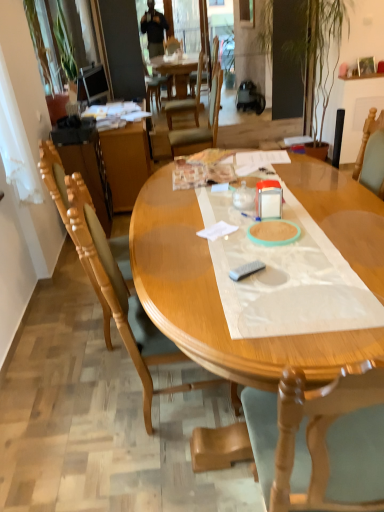
This screenshot has height=512, width=384. Describe the element at coordinates (92, 85) in the screenshot. I see `matte black television at upper left` at that location.

This screenshot has width=384, height=512. What do you see at coordinates (113, 167) in the screenshot?
I see `wooden desk at center` at bounding box center [113, 167].

In order to click on transparent plastic bottle at center in this screenshot , I will do `click(244, 197)`.

Which point is more forward, (299,271) or (355,335)?

Point (355,335)

Can you confirm if transparent plastic sheet at center is smaller than wooden table at center?

Indeed, transparent plastic sheet at center has a smaller size compared to wooden table at center.

From a real-world perspective, which is physically below, transparent plastic sheet at center or wooden table at center?

wooden table at center is physically lower.

Is transparent plastic sheet at center far from wooden table at center?

No, there isn't a large distance between transparent plastic sheet at center and wooden table at center.

The width and height of the screenshot is (384, 512). There is a wooden desk at center. In order to click on the 2nd chair above it (from a real-world perspective) in this screenshot , I will do `click(110, 279)`.

Is wooden chair at left, the first chair viewed from the front, beside wooden desk at center?

No, wooden chair at left, the first chair viewed from the front, is not in contact with wooden desk at center.

Considering the relative positions of wooden chair at left, which is counted as the third chair, starting from the back, and wooden desk at center in the image provided, is wooden chair at left, which is counted as the third chair, starting from the back, behind wooden desk at center?

No, wooden chair at left, which is counted as the third chair, starting from the back, is closer to the viewer.

Does wooden chair at left, which is counted as the third chair, starting from the back, turn towards wooden desk at center?

No.

Is light brown wood chair at left, the 2th chair in the front-to-back sequence, next to green leafy plant at upper left and touching it?

No, light brown wood chair at left, the 2th chair in the front-to-back sequence, is not next to green leafy plant at upper left.

Which point is more distant from viewer, (x=107, y=333) or (x=57, y=96)?

Positioned behind is point (x=57, y=96).

Which object is further away from the camera taking this photo, light brown wood chair at left, marked as the 2th chair in a back-to-front arrangement, or green leafy plant at upper left?

green leafy plant at upper left.

Measure the distance between light brown wood chair at left, marked as the 2th chair in a back-to-front arrangement, and green leafy plant at upper left.

9.46 feet.

Can transparent plastic sheet at center be found inside metallic silver container at center?

Actually, transparent plastic sheet at center is outside metallic silver container at center.

Which is more to the right, metallic silver container at center or transparent plastic sheet at center?

metallic silver container at center.

From the image's perspective, which is below, metallic silver container at center or transparent plastic sheet at center?

transparent plastic sheet at center.

In the scene shown: Which of these two, metallic silver container at center or transparent plastic sheet at center, is bigger?

With larger size is transparent plastic sheet at center.

Where is `chair that is the 1st one below the matte black television at upper left (from a real-world perspective)`? The image size is (384, 512). chair that is the 1st one below the matte black television at upper left (from a real-world perspective) is located at coordinates (198, 125).

From the picture: Would you say matte black television at upper left is outside wooden chair at center, acting as the third chair starting from the front?

matte black television at upper left is positioned outside wooden chair at center, acting as the third chair starting from the front.

Does matte black television at upper left have a larger size compared to wooden chair at center, which is the 1th chair from back to front?

No, matte black television at upper left is not bigger than wooden chair at center, which is the 1th chair from back to front.

From a real-world perspective, is matte black television at upper left positioned under wooden chair at center, which is the 1th chair from back to front, based on gravity?

No, from a real-world perspective, matte black television at upper left is not below wooden chair at center, which is the 1th chair from back to front.

Which object is more forward, wooden table at center or wooden chair at left, the first chair viewed from the front?

wooden table at center is in front.

Is there a large distance between wooden table at center and wooden chair at left, the first chair viewed from the front?

No, wooden table at center is not far away from wooden chair at left, the first chair viewed from the front.

Looking at this image, is wooden table at center facing towards wooden chair at left, which is counted as the third chair, starting from the back?

Yes.

Which is correct: wooden table at center is inside wooden chair at left, which is counted as the third chair, starting from the back, or outside of it?

wooden table at center is outside wooden chair at left, which is counted as the third chair, starting from the back.

Is wooden chair at left, the first chair viewed from the front, surrounded by wooden desk at center?

No, wooden chair at left, the first chair viewed from the front, is not inside wooden desk at center.

From a real-world perspective, which object rests below the other?

wooden desk at center.

Is wooden desk at center looking in the opposite direction of wooden chair at left, which is counted as the third chair, starting from the back?

wooden desk at center does not have its back to wooden chair at left, which is counted as the third chair, starting from the back.

What's the angular difference between wooden desk at center and wooden chair at left, which is counted as the third chair, starting from the back,'s facing directions?

7.79 degrees separate the facing orientations of wooden desk at center and wooden chair at left, which is counted as the third chair, starting from the back.

At what (x,y) coordinates should I click in order to perform the action: click on sheet that appears above the wooden table at center (from the image's perspective). Please return your answer as a coordinate pair (x, y). Looking at the image, I should click on point(285,277).

You are a GUI agent. You are given a task and a screenshot of the screen. Output one action in this format:
    pyautogui.click(x=<x>, y=<y>)
    Task: Click on the 2nd chair directly above the wooden desk at center (from a real-world perspective)
    The width and height of the screenshot is (384, 512).
    Given the screenshot: What is the action you would take?
    pyautogui.click(x=110, y=279)

Looking at the image, which one is located further to metallic silver container at center, transparent plastic sheet at center or wooden chair at left, the first chair viewed from the front?

wooden chair at left, the first chair viewed from the front, is positioned further to the anchor metallic silver container at center.

Based on their spatial positions, is light brown wood chair at left, the 2th chair in the front-to-back sequence, or transparent plastic sheet at center closer to green leafy plant at upper left?

light brown wood chair at left, the 2th chair in the front-to-back sequence, lies closer to green leafy plant at upper left than the other object.

Based on their spatial positions, is metallic silver container at center or wooden table at center closer to wooden desk at center?

wooden table at center is closer to wooden desk at center.

Estimate the real-world distances between objects in this image. Which object is closer to wooden chair at center, acting as the third chair starting from the front, transparent plastic sheet at center or wooden table at center?

wooden table at center is closer to wooden chair at center, acting as the third chair starting from the front.

Which object lies further to the anchor point wooden chair at center, acting as the third chair starting from the front, light brown wood chair at left, marked as the 2th chair in a back-to-front arrangement, or transparent plastic sheet at center?

Based on the image, transparent plastic sheet at center appears to be further to wooden chair at center, acting as the third chair starting from the front.

Considering their positions, is transparent plastic bottle at center positioned closer to wooden table at center than wooden desk at center?

transparent plastic bottle at center is closer to wooden table at center.

When comparing their distances from wooden desk at center, does wooden chair at left, which is counted as the third chair, starting from the back, or green leafy plant at upper left seem closer?

green leafy plant at upper left lies closer to wooden desk at center than the other object.

Looking at the image, which one is located closer to metallic silver container at center, wooden table at center or green leafy plant at upper left?

The object closer to metallic silver container at center is wooden table at center.

Locate an element on the screen. This screenshot has width=384, height=512. sheet between wooden table at center and wooden chair at center, which is the 1th chair from back to front, from front to back is located at coordinates (285, 277).

In order to click on chair between metallic silver container at center and wooden desk at center from front to back in this screenshot , I will do `click(68, 217)`.

This screenshot has width=384, height=512. I want to click on bottle located between metallic silver container at center and wooden desk at center in the depth direction, so click(244, 197).

Image resolution: width=384 pixels, height=512 pixels. What are the coordinates of `computer desk located between light brown wood chair at left, the 2th chair in the front-to-back sequence, and matte black television at upper left in the depth direction` in the screenshot? It's located at (113, 167).